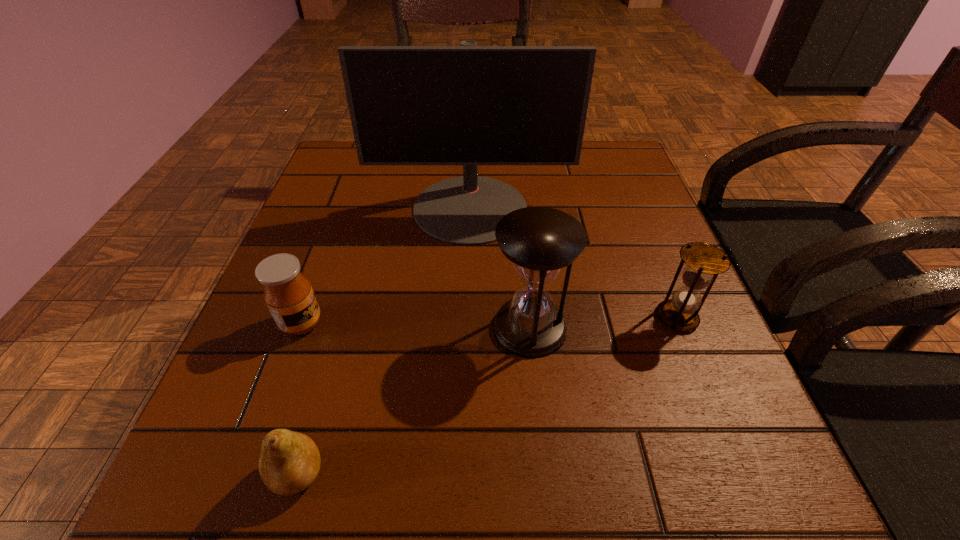
Locate an element on the screen. This screenshot has height=540, width=960. vacant region between the rightmost object and the pear is located at coordinates (487, 396).

At what (x,y) coordinates should I click in order to perform the action: click on free space between the honey and the nearest object. Please return your answer as a coordinate pair (x, y). The width and height of the screenshot is (960, 540). Looking at the image, I should click on (300, 399).

In order to click on vacant area that lies between the tallest object and the taller hourglass in this screenshot , I will do `click(500, 268)`.

Where is `vacant area that lies between the honey and the left hourglass`? Image resolution: width=960 pixels, height=540 pixels. vacant area that lies between the honey and the left hourglass is located at coordinates (416, 325).

Where is `free space between the rightmost object and the honey`? This screenshot has width=960, height=540. free space between the rightmost object and the honey is located at coordinates pos(490,320).

Image resolution: width=960 pixels, height=540 pixels. Identify the location of vacant point located between the honey and the pear. (300, 399).

Locate an element on the screen. free space that is in between the farthest object and the left hourglass is located at coordinates (500, 268).

This screenshot has width=960, height=540. I want to click on free point between the tallest object and the pear, so click(x=384, y=341).

Select which object is the closest to the left hourglass. Please provide its 2D coordinates. Your answer should be formatted as a tuple, i.e. [(x, y)], where the tuple contains the x and y coordinates of a point satisfying the conditions above.

[(469, 105)]

Where is `object that is the closest to the left hourglass`? The height and width of the screenshot is (540, 960). object that is the closest to the left hourglass is located at coordinates (469, 105).